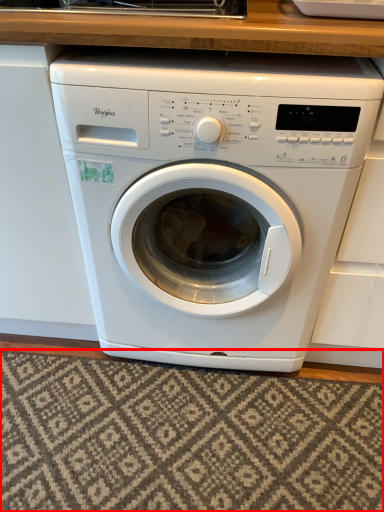
Question: Where is mat (annotated by the red box) located in relation to washing machine in the image?

Choices:
 (A) right
 (B) left

Answer: (B)